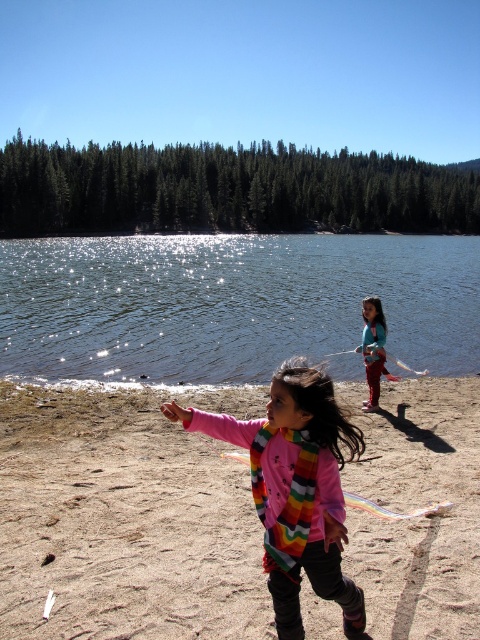
The height and width of the screenshot is (640, 480). Describe the element at coordinates (121, 522) in the screenshot. I see `smooth beige sand at lower center` at that location.

Can you confirm if smooth beige sand at lower center is shorter than rainbow striped scarf at center?

Yes, smooth beige sand at lower center is shorter than rainbow striped scarf at center.

Describe the element at coordinates (121, 522) in the screenshot. I see `smooth beige sand at lower center` at that location.

Where is `smooth beige sand at lower center`? smooth beige sand at lower center is located at coordinates (121, 522).

Is smooth beige sand at lower center bigger than sparkling water at lake center?

No, smooth beige sand at lower center is not bigger than sparkling water at lake center.

Can you confirm if smooth beige sand at lower center is shorter than sparkling water at lake center?

Indeed, smooth beige sand at lower center has a lesser height compared to sparkling water at lake center.

Which is in front, point (419, 540) or point (214, 340)?

Point (419, 540) is in front.

Identify the location of smooth beige sand at lower center. The image size is (480, 640). (121, 522).

Measure the distance between sparkling water at lake center and multicolored scarf at right.

sparkling water at lake center and multicolored scarf at right are 48.97 meters apart.

Is sparkling water at lake center behind multicolored scarf at right?

Yes, it is behind multicolored scarf at right.

Find the location of a particular element. sparkling water at lake center is located at coordinates (231, 305).